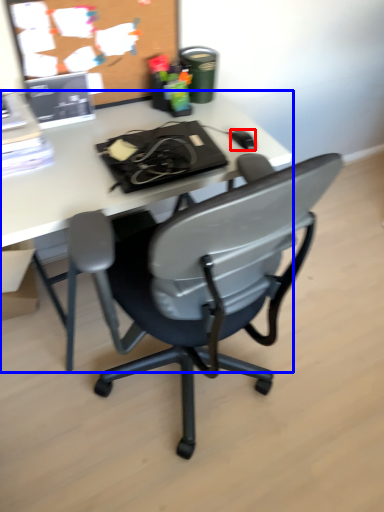
Question: Which object appears farthest to the camera in this image, mouse (highlighted by a red box) or desk (highlighted by a blue box)?

Choices:
 (A) mouse
 (B) desk

Answer: (A)